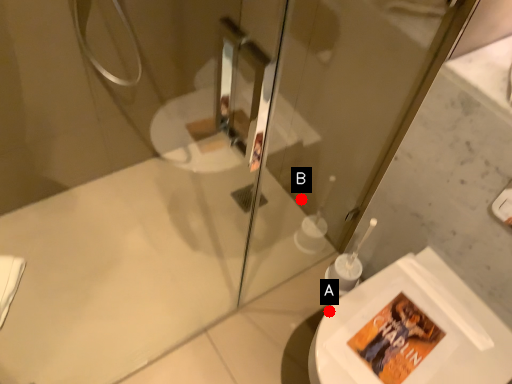
Question: Two points are circled on the image, labeled by A and B beside each circle. Which point is closer to the camera taking this photo?

Choices:
 (A) A is closer
 (B) B is closer

Answer: (A)